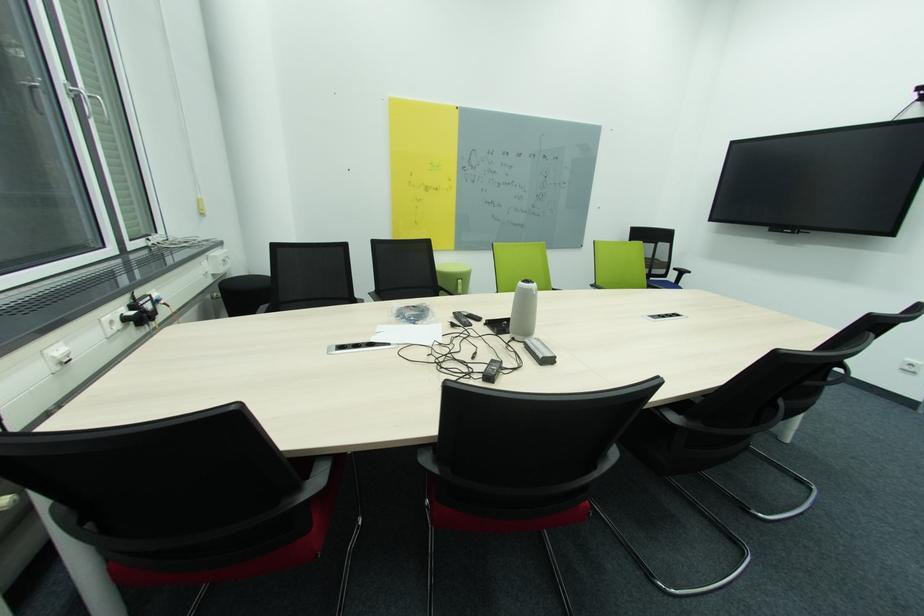
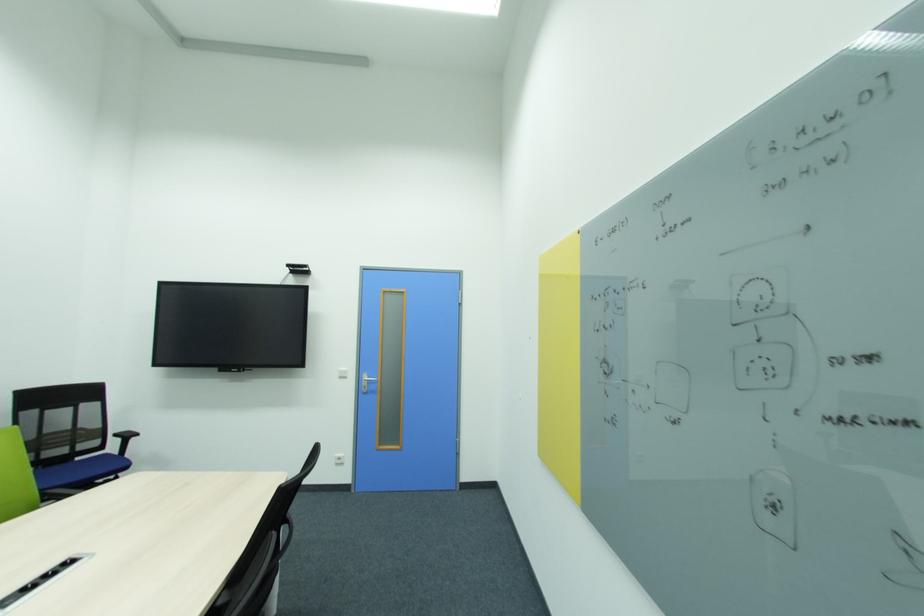
Question: The images are taken continuously from a first-person perspective. In which direction is your viewpoint rotating?

Choices:
 (A) Left
 (B) Right
 (C) Up
 (D) Down

Answer: (B)